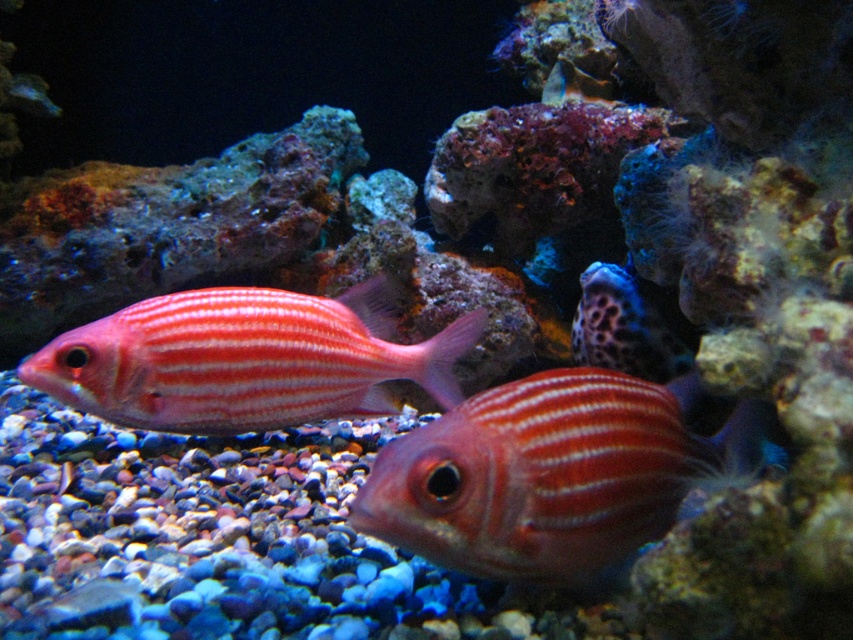
Which is more to the left, shiny pink fish at center or leopard print rock at center?

Positioned to the left is shiny pink fish at center.

Between point (167, 320) and point (607, 332), which one is positioned behind?

The point (607, 332) is more distant.

Describe the element at coordinates (247, 358) in the screenshot. I see `shiny pink fish at center` at that location.

You are a GUI agent. You are given a task and a screenshot of the screen. Output one action in this format:
    pyautogui.click(x=<x>, y=<y>)
    Task: Click on the shiny pink fish at center
    This screenshot has width=853, height=640.
    Given the screenshot: What is the action you would take?
    247,358

Does shiny red fish at center appear over shiny pink fish at center?

Incorrect, shiny red fish at center is not positioned above shiny pink fish at center.

The width and height of the screenshot is (853, 640). What do you see at coordinates (552, 474) in the screenshot?
I see `shiny red fish at center` at bounding box center [552, 474].

Where is `shiny red fish at center`? The height and width of the screenshot is (640, 853). shiny red fish at center is located at coordinates (552, 474).

Between shiny red fish at center and leopard print rock at center, which one has less height?

With less height is leopard print rock at center.

Who is lower down, shiny red fish at center or leopard print rock at center?

Positioned lower is shiny red fish at center.

Is point (643, 448) positioned after point (592, 307)?

No, it is not.

You are a GUI agent. You are given a task and a screenshot of the screen. Output one action in this format:
    pyautogui.click(x=<x>, y=<y>)
    Task: Click on the shiny red fish at center
    
    Given the screenshot: What is the action you would take?
    pyautogui.click(x=552, y=474)